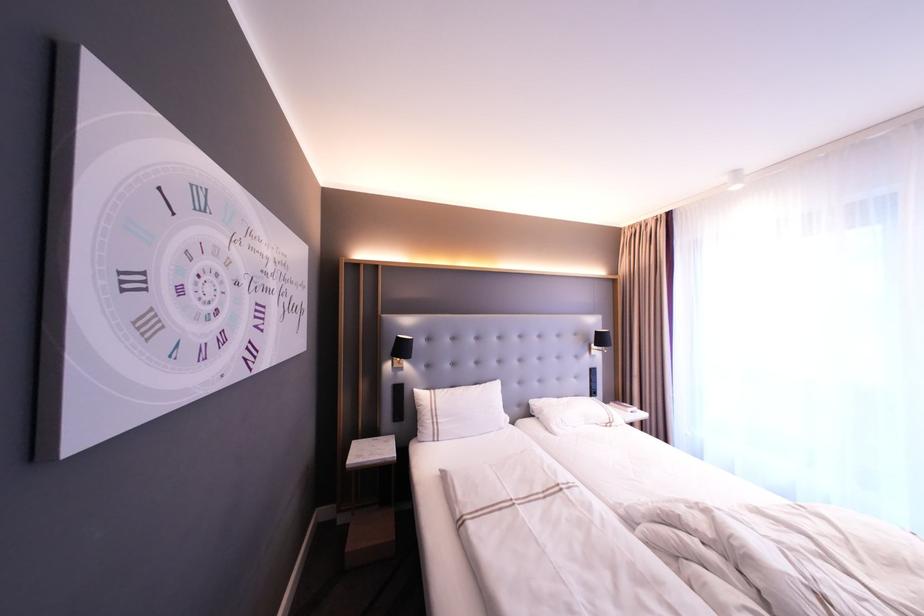
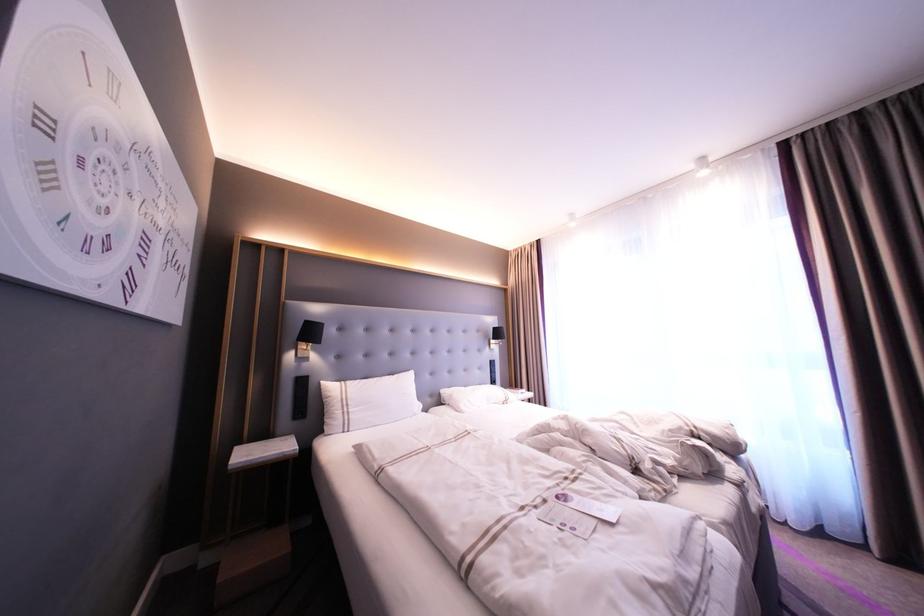
Which direction would the cameraman need to move to produce the second image?

The cameraman walked toward left, backward.